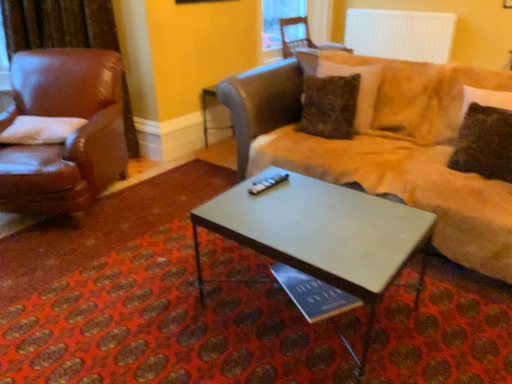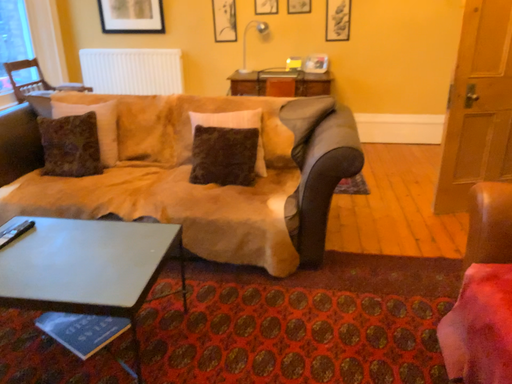
Question: Which way did the camera rotate in the video?

Choices:
 (A) rotated upward
 (B) rotated downward

Answer: (A)